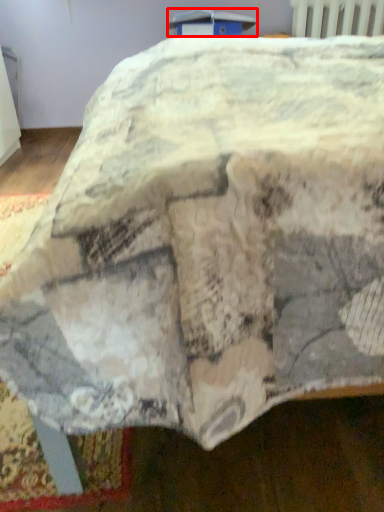
Question: From the image's perspective, where is table (annotated by the red box) located in relation to radiator in the image?

Choices:
 (A) below
 (B) above

Answer: (A)